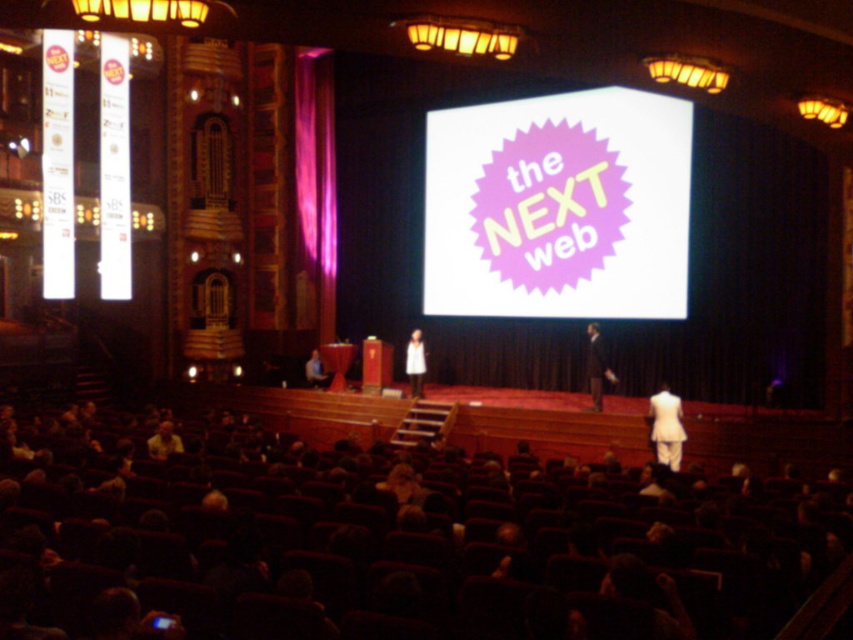
You are an event photographer standing at the back of the auditorium. You need to capture a photo of both the white fabric dress at lower right and the white suit at center. Based on their positions, which one is closer to the ground?

The white fabric dress at lower right is below the white suit at center, so it is closer to the ground.